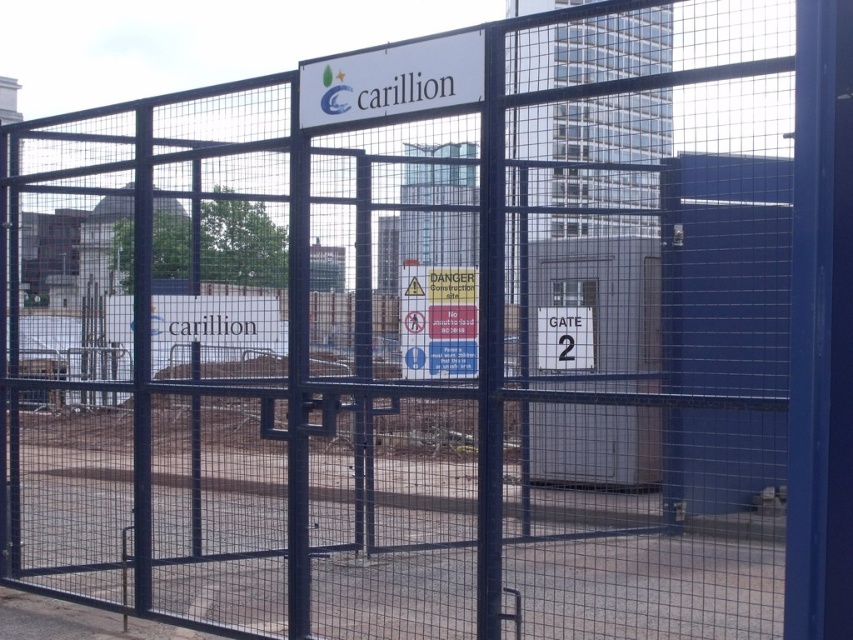
Which is below, white plastic sign at center or white plastic gate at center?

white plastic gate at center is lower down.

Consider the image. Can you confirm if white plastic sign at center is shorter than white plastic gate at center?

No.

This screenshot has height=640, width=853. Describe the element at coordinates (438, 321) in the screenshot. I see `white plastic sign at center` at that location.

At what (x,y) coordinates should I click in order to perform the action: click on white plastic sign at center. Please return your answer as a coordinate pair (x, y). Image resolution: width=853 pixels, height=640 pixels. Looking at the image, I should click on (438, 321).

Does point (415, 54) come in front of point (463, 316)?

Yes, it is.

The height and width of the screenshot is (640, 853). Describe the element at coordinates (392, 81) in the screenshot. I see `white plastic sign at upper center` at that location.

What are the coordinates of `white plastic sign at upper center` in the screenshot? It's located at (392, 81).

Where is `white plastic sign at upper center`? The height and width of the screenshot is (640, 853). white plastic sign at upper center is located at coordinates (392, 81).

What do you see at coordinates (392, 81) in the screenshot? The width and height of the screenshot is (853, 640). I see `white plastic sign at upper center` at bounding box center [392, 81].

Is white plastic sign at upper center bigger than white plastic gate at center?

Yes.

Who is more distant from viewer, (318, 74) or (540, 314)?

Positioned behind is point (540, 314).

At what (x,y) coordinates should I click in order to perform the action: click on white plastic sign at upper center. Please return your answer as a coordinate pair (x, y). Looking at the image, I should click on (392, 81).